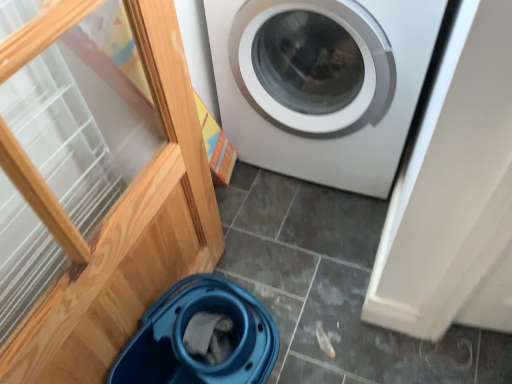
Image resolution: width=512 pixels, height=384 pixels. What do you see at coordinates (322, 83) in the screenshot?
I see `white glossy washing machine at center` at bounding box center [322, 83].

Locate an element on the screen. white glossy washing machine at center is located at coordinates (322, 83).

Locate an element on the screen. The width and height of the screenshot is (512, 384). blue plastic bucket at lower left is located at coordinates pos(201,337).

This screenshot has height=384, width=512. What do you see at coordinates (201, 337) in the screenshot?
I see `blue plastic bucket at lower left` at bounding box center [201, 337].

This screenshot has height=384, width=512. I want to click on white glossy washing machine at center, so click(x=322, y=83).

Would you say blue plastic bucket at lower left is to the left or to the right of white glossy washing machine at center in the picture?

From the image, it's evident that blue plastic bucket at lower left is to the left of white glossy washing machine at center.

Is the depth of blue plastic bucket at lower left less than that of white glossy washing machine at center?

Yes.

Between point (182, 330) and point (377, 150), which one is positioned in front?

The point (182, 330) is in front.

From the image's perspective, is blue plastic bucket at lower left located beneath white glossy washing machine at center?

Indeed, from the image's perspective, blue plastic bucket at lower left is shown beneath white glossy washing machine at center.

From the picture: From a real-world perspective, which object rests below the other?

blue plastic bucket at lower left.

Does blue plastic bucket at lower left have a lesser width compared to white glossy washing machine at center?

Indeed, blue plastic bucket at lower left has a lesser width compared to white glossy washing machine at center.

Considering the sizes of blue plastic bucket at lower left and white glossy washing machine at center in the image, is blue plastic bucket at lower left taller or shorter than white glossy washing machine at center?

In the image, blue plastic bucket at lower left appears to be shorter than white glossy washing machine at center.

Is blue plastic bucket at lower left bigger or smaller than white glossy washing machine at center?

blue plastic bucket at lower left is smaller than white glossy washing machine at center.

Would you say blue plastic bucket at lower left is inside or outside white glossy washing machine at center?

blue plastic bucket at lower left is not enclosed by white glossy washing machine at center.

Are blue plastic bucket at lower left and white glossy washing machine at center located far from each other?

blue plastic bucket at lower left is near white glossy washing machine at center, not far away.

Is blue plastic bucket at lower left facing towards white glossy washing machine at center?

No, blue plastic bucket at lower left does not turn towards white glossy washing machine at center.

Measure the distance between blue plastic bucket at lower left and white glossy washing machine at center.

blue plastic bucket at lower left is 25.72 inches from white glossy washing machine at center.

Where is `dish washer lying below the white glossy washing machine at center (from the image's perspective)`? Image resolution: width=512 pixels, height=384 pixels. dish washer lying below the white glossy washing machine at center (from the image's perspective) is located at coordinates (201, 337).

Based on their positions, is white glossy washing machine at center located to the left or right of blue plastic bucket at lower left?

Based on their positions, white glossy washing machine at center is located to the right of blue plastic bucket at lower left.

Is white glossy washing machine at center in front of or behind blue plastic bucket at lower left in the image?

white glossy washing machine at center is behind blue plastic bucket at lower left.

Which is behind, point (383, 133) or point (205, 377)?

Point (383, 133)

From the image's perspective, between white glossy washing machine at center and blue plastic bucket at lower left, which one is located above?

From the image's view, white glossy washing machine at center is above.

From a real-world perspective, is white glossy washing machine at center on blue plastic bucket at lower left?

Indeed, from a real-world perspective, white glossy washing machine at center stands above blue plastic bucket at lower left.

Consider the image. Can you confirm if white glossy washing machine at center is thinner than blue plastic bucket at lower left?

In fact, white glossy washing machine at center might be wider than blue plastic bucket at lower left.

Who is shorter, white glossy washing machine at center or blue plastic bucket at lower left?

With less height is blue plastic bucket at lower left.

Based on the photo, considering the sizes of objects white glossy washing machine at center and blue plastic bucket at lower left in the image provided, who is smaller, white glossy washing machine at center or blue plastic bucket at lower left?

Smaller between the two is blue plastic bucket at lower left.

Is white glossy washing machine at center not inside blue plastic bucket at lower left?

white glossy washing machine at center is positioned outside blue plastic bucket at lower left.

Is white glossy washing machine at center far away from blue plastic bucket at lower left?

No, white glossy washing machine at center is in close proximity to blue plastic bucket at lower left.

Is blue plastic bucket at lower left at the back of white glossy washing machine at center?

That's not correct — white glossy washing machine at center is not looking away from blue plastic bucket at lower left.

Can you tell me how much white glossy washing machine at center and blue plastic bucket at lower left differ in facing direction?

There is a 81.6-degree angle between the facing directions of white glossy washing machine at center and blue plastic bucket at lower left.

Measure the distance from white glossy washing machine at center to blue plastic bucket at lower left.

They are 25.72 inches apart.

Find the location of a particular element. The image size is (512, 384). washing machine above the blue plastic bucket at lower left (from a real-world perspective) is located at coordinates (322, 83).

The height and width of the screenshot is (384, 512). There is a blue plastic bucket at lower left. What are the coordinates of `washing machine above it (from a real-world perspective)` in the screenshot? It's located at click(322, 83).

You are a GUI agent. You are given a task and a screenshot of the screen. Output one action in this format:
    pyautogui.click(x=<x>, y=<y>)
    Task: Click on the dish washer to the left of white glossy washing machine at center
    This screenshot has width=512, height=384.
    Given the screenshot: What is the action you would take?
    pyautogui.click(x=201, y=337)